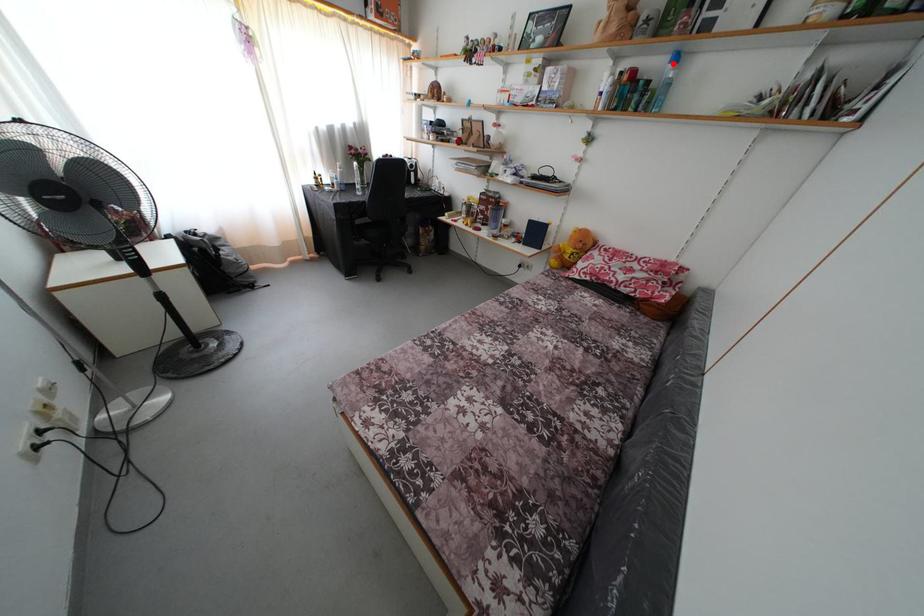
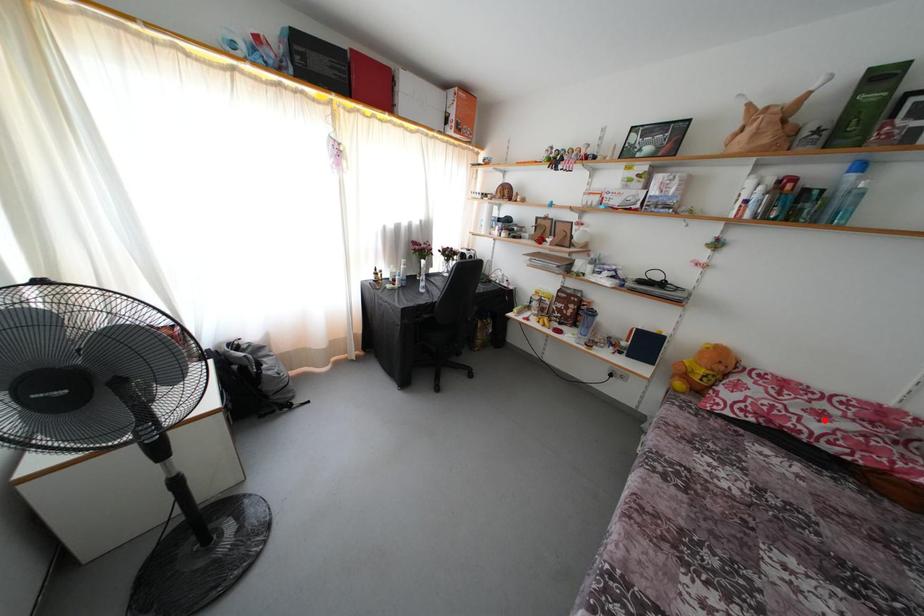
I am providing you with two images of the same scene from different viewpoints. A red point is marked on the first image and another point is marked on the second image. Do the highlighted points in image1 and image2 indicate the same real-world spot?

No